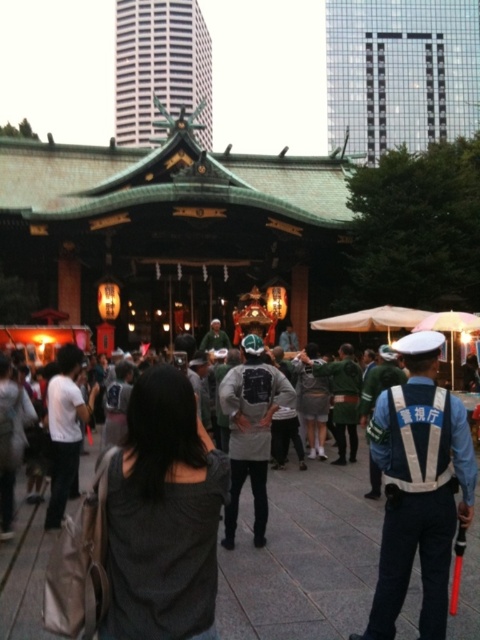
Question: Can you confirm if dark gray fabric crowd at center is positioned below white matte shirt at left?

Choices:
 (A) no
 (B) yes

Answer: (B)

Question: Does green glazed tile temple at upper center appear on the right side of dark gray fabric backpack at lower left?

Choices:
 (A) no
 (B) yes

Answer: (B)

Question: Which of the following is the farthest from the observer?

Choices:
 (A) dark gray fabric crowd at center
 (B) blue uniform at center
 (C) gray fabric backpack at center

Answer: (C)

Question: Estimate the real-world distances between objects in this image. Which object is closer to the gray fabric backpack at center?

Choices:
 (A) white matte shirt at left
 (B) blue uniform at center
 (C) green matte temple at upper center

Answer: (B)

Question: Based on their relative distances, which object is nearer to the dark gray fabric at center?

Choices:
 (A) white matte shirt at left
 (B) dark gray fabric crowd at center
 (C) green glazed tile temple at upper center

Answer: (B)

Question: Is gray fabric backpack at center positioned before dark gray fabric backpack at lower left?

Choices:
 (A) no
 (B) yes

Answer: (B)